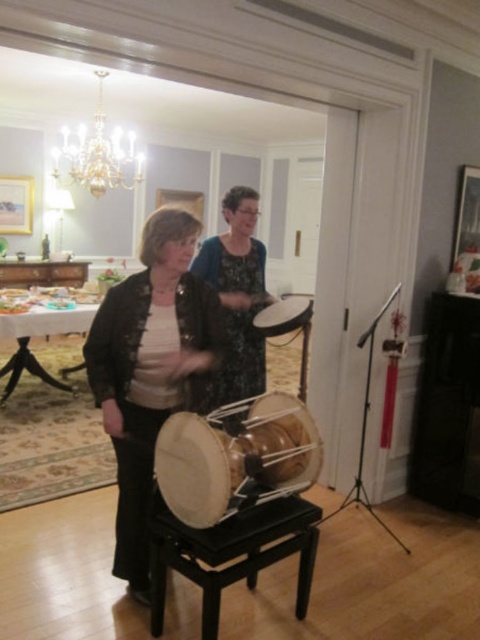
Question: Estimate the real-world distances between objects in this image. Which object is farther from the matte black jacket at center?

Choices:
 (A) light brown wooden drum at center
 (B) dark floral dress at center
 (C) black wood stool at center

Answer: (C)

Question: Observing the image, what is the correct spatial positioning of wooden drum at center in reference to smooth wooden drum at center?

Choices:
 (A) right
 (B) left

Answer: (B)

Question: Which point is farther from the camera taking this photo?

Choices:
 (A) pyautogui.click(x=267, y=330)
 (B) pyautogui.click(x=248, y=545)

Answer: (A)

Question: Is crystal glass chandelier at upper left to the right of smooth wooden drum at center from the viewer's perspective?

Choices:
 (A) yes
 (B) no

Answer: (B)

Question: Is the position of dark floral dress at center less distant than that of light brown wooden drum at center?

Choices:
 (A) yes
 (B) no

Answer: (B)

Question: Which point is closer to the camera?

Choices:
 (A) [300, 401]
 (B) [105, 74]
 (C) [303, 317]

Answer: (C)